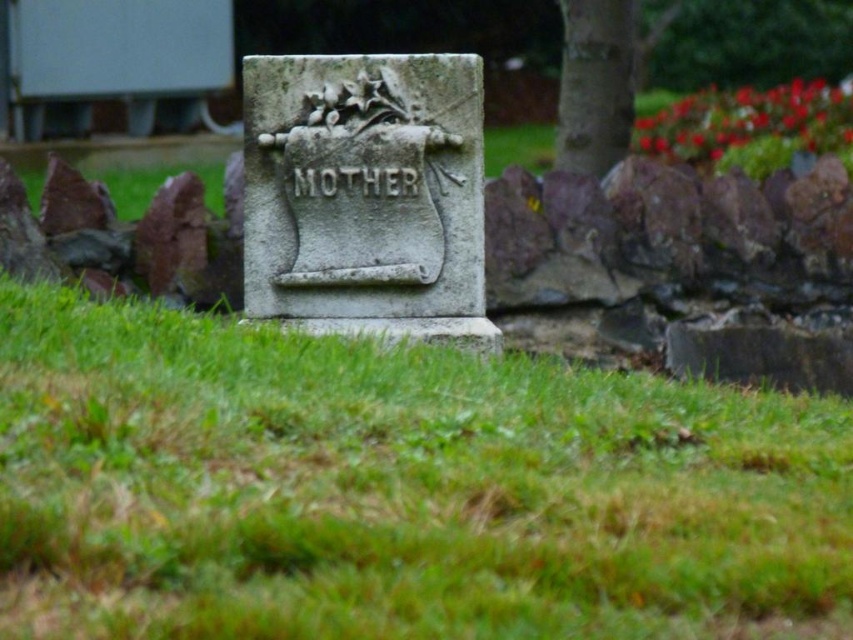
Is green grass at center smaller than smooth bark tree at upper right?

Yes.

Measure the distance between point (575, 400) and camera.

The distance of point (575, 400) from camera is 10.46 meters.

Locate an element on the screen. This screenshot has width=853, height=640. green grass at center is located at coordinates (396, 488).

Based on the photo, who is more distant from viewer, (291, 145) or (595, 26)?

The point (595, 26) is more distant.

Can you confirm if gray stone gravestone at center is bigger than smooth bark tree at upper right?

No.

Who is more distant from viewer, (x=463, y=193) or (x=610, y=1)?

The point (x=610, y=1) is more distant.

Find the location of a particular element. gray stone gravestone at center is located at coordinates (366, 195).

Locate an element on the screen. This screenshot has height=640, width=853. green grass at center is located at coordinates (396, 488).

Is point (717, 385) positioned in front of point (314, 118)?

That is True.

Find the location of a particular element. green grass at center is located at coordinates (396, 488).